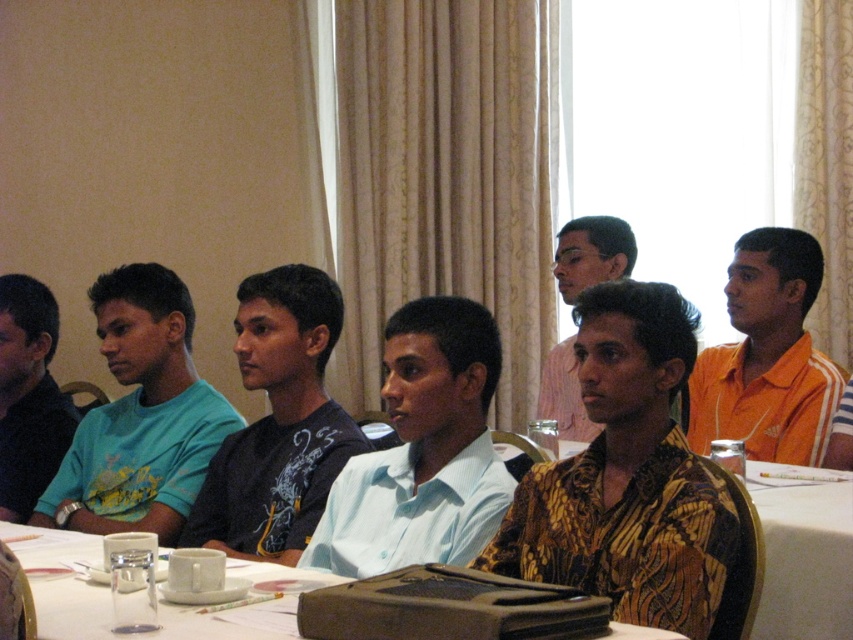
You are standing at the point labeled as point (712,492) and want to reach the door located at the far end of the room. Considering the distance between you and the door is 1.46 meters, can you walk straight to it without any obstacles?

Yes, you can walk straight to the door located at the far end of the room since the distance between you and the door is 1.46 meters, which is a manageable distance without any obstacles mentioned.

You are sitting at the white glossy table at center and want to pass a document to the light blue shirt at left. Since the table is between you and them, which direction should you move to hand the document directly?

The white glossy table at center is to the right of the light blue shirt at left, so you should move to your left to hand the document directly to the light blue shirt at left.

Based on the photo, you are a photographer setting up for a group photo. You want to ensure that the white glossy table at center is visible in the shot without being blocked by the light blue shirt at left. Based on the scene description, what adjustment should you make to your camera angle?

The white glossy table at center is positioned under the light blue shirt at left, so to avoid blocking the table, you should angle the camera downward to capture the table below the person wearing the light blue shirt at left.